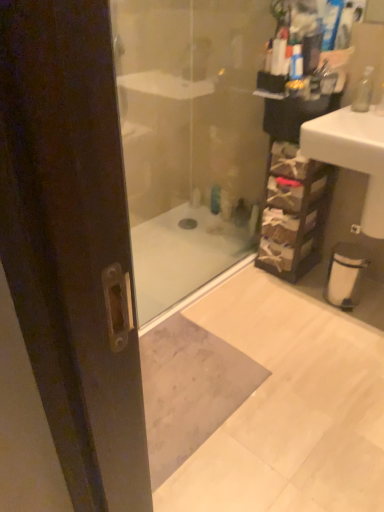
Question: Can you confirm if white glossy sink at right is shorter than translucent plastic bottle at center?

Choices:
 (A) yes
 (B) no

Answer: (B)

Question: Does white glossy sink at right have a larger size compared to translucent plastic bottle at center?

Choices:
 (A) yes
 (B) no

Answer: (A)

Question: Does white glossy sink at right appear on the left side of translucent plastic bottle at center?

Choices:
 (A) yes
 (B) no

Answer: (B)

Question: Would you say white glossy sink at right is outside translucent plastic bottle at center?

Choices:
 (A) yes
 (B) no

Answer: (A)

Question: Are white glossy sink at right and translucent plastic bottle at center making contact?

Choices:
 (A) no
 (B) yes

Answer: (A)

Question: Is white glossy sink at right smaller than translucent plastic bottle at center?

Choices:
 (A) no
 (B) yes

Answer: (A)

Question: Is translucent plastic bottle at center oriented away from clear glass soap dispenser at upper right?

Choices:
 (A) yes
 (B) no

Answer: (B)

Question: Does translucent plastic bottle at center appear on the left side of clear glass soap dispenser at upper right?

Choices:
 (A) yes
 (B) no

Answer: (A)

Question: Does translucent plastic bottle at center come behind clear glass soap dispenser at upper right?

Choices:
 (A) yes
 (B) no

Answer: (A)

Question: Considering the relative sizes of translucent plastic bottle at center and clear glass soap dispenser at upper right in the image provided, is translucent plastic bottle at center shorter than clear glass soap dispenser at upper right?

Choices:
 (A) no
 (B) yes

Answer: (B)

Question: Can you confirm if translucent plastic bottle at center is wider than clear glass soap dispenser at upper right?

Choices:
 (A) no
 (B) yes

Answer: (A)

Question: Does translucent plastic bottle at center have a smaller size compared to clear glass soap dispenser at upper right?

Choices:
 (A) no
 (B) yes

Answer: (B)

Question: Does clear glass soap dispenser at upper right turn towards translucent plastic bottle at center?

Choices:
 (A) no
 (B) yes

Answer: (A)